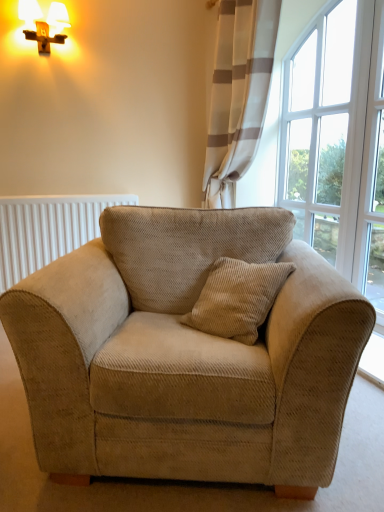
Question: Is white ribbed radiator at left outside beige corduroy armchair at center?

Choices:
 (A) no
 (B) yes

Answer: (B)

Question: From the image's perspective, does white ribbed radiator at left appear lower than beige corduroy armchair at center?

Choices:
 (A) no
 (B) yes

Answer: (A)

Question: Is white ribbed radiator at left next to beige corduroy armchair at center and touching it?

Choices:
 (A) no
 (B) yes

Answer: (A)

Question: Is beige corduroy armchair at center completely or partially inside white ribbed radiator at left?

Choices:
 (A) no
 (B) yes

Answer: (A)

Question: Is white ribbed radiator at left smaller than beige corduroy armchair at center?

Choices:
 (A) no
 (B) yes

Answer: (B)

Question: Considering the relative sizes of white ribbed radiator at left and beige corduroy armchair at center in the image provided, is white ribbed radiator at left wider than beige corduroy armchair at center?

Choices:
 (A) yes
 (B) no

Answer: (B)

Question: Is there a large distance between white textured curtain at upper right and beige corduroy armchair at center?

Choices:
 (A) yes
 (B) no

Answer: (A)

Question: Is white textured curtain at upper right shorter than beige corduroy armchair at center?

Choices:
 (A) no
 (B) yes

Answer: (A)

Question: Can you confirm if white textured curtain at upper right is bigger than beige corduroy armchair at center?

Choices:
 (A) no
 (B) yes

Answer: (A)

Question: Considering the relative sizes of white textured curtain at upper right and beige corduroy armchair at center in the image provided, is white textured curtain at upper right smaller than beige corduroy armchair at center?

Choices:
 (A) no
 (B) yes

Answer: (B)

Question: Is white textured curtain at upper right surrounding beige corduroy armchair at center?

Choices:
 (A) no
 (B) yes

Answer: (A)

Question: Is white textured curtain at upper right positioned with its back to beige corduroy armchair at center?

Choices:
 (A) no
 (B) yes

Answer: (A)

Question: Is beige corduroy armchair at center facing towards white ribbed radiator at left?

Choices:
 (A) no
 (B) yes

Answer: (A)